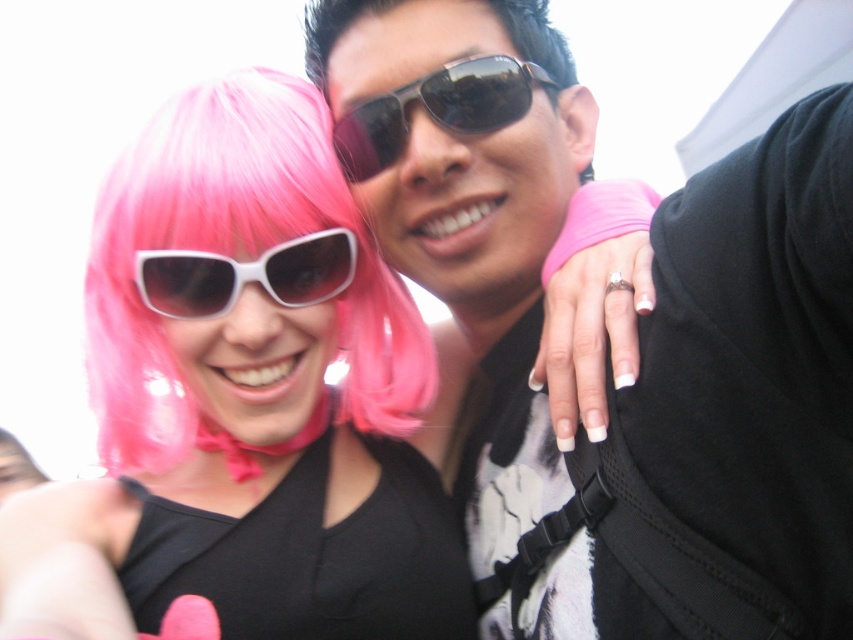
Question: Which point appears farthest from the camera in this image?

Choices:
 (A) (350, 304)
 (B) (436, 634)

Answer: (A)

Question: Observing the image, what is the correct spatial positioning of matte black sunglasses at upper center in reference to white matte sunglasses at center?

Choices:
 (A) right
 (B) left

Answer: (A)

Question: Which point is closer to the camera?

Choices:
 (A) sunglasses at center
 (B) black matte dress at center
 (C) matte pink wig at center

Answer: (B)

Question: Does sunglasses at center appear on the left side of white matte sunglasses at center?

Choices:
 (A) no
 (B) yes

Answer: (A)

Question: Considering the relative positions of matte black sunglasses at upper center and matte pink wig at center in the image provided, where is matte black sunglasses at upper center located with respect to matte pink wig at center?

Choices:
 (A) above
 (B) below

Answer: (A)

Question: Which point is farther to the camera?

Choices:
 (A) white matte sunglasses at center
 (B) sunglasses at center

Answer: (B)